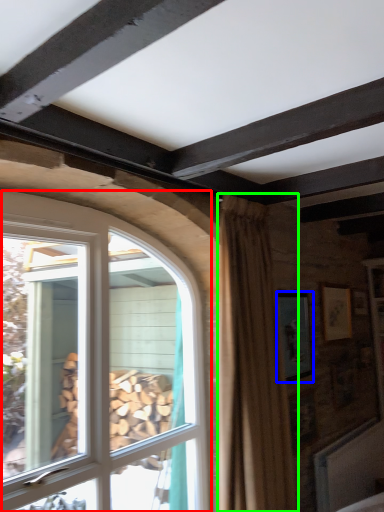
Question: Which object is the closest to the window (highlighted by a red box)? Choose among these: picture frame (highlighted by a blue box) or curtain (highlighted by a green box).

Choices:
 (A) picture frame
 (B) curtain

Answer: (B)